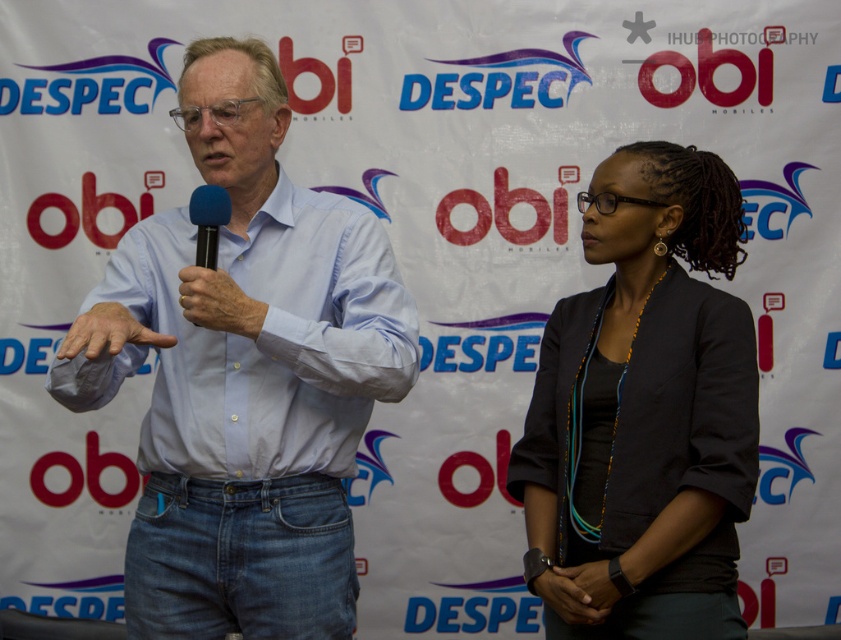
You are a photographer at the event and need to adjust the lighting between the dark gray blazer at center and the black matte microphone at center. The minimum distance required for the lighting equipment to function properly is 1 meter. Based on the current setup, will the equipment work effectively between these two objects?

The distance between the dark gray blazer at center and the black matte microphone at center is 93.70 centimeters, which is less than the required 1 meter. Therefore, the lighting equipment will not function effectively at this distance.

You are standing at the origin of the coordinate system in the image. You want to move towards the point labeled point (307, 280). Will you pass by the point labeled point (214, 264) first?

Yes, because point (307, 280) is behind point (214, 264), so you will pass by point (214, 264) first before reaching point (307, 280).